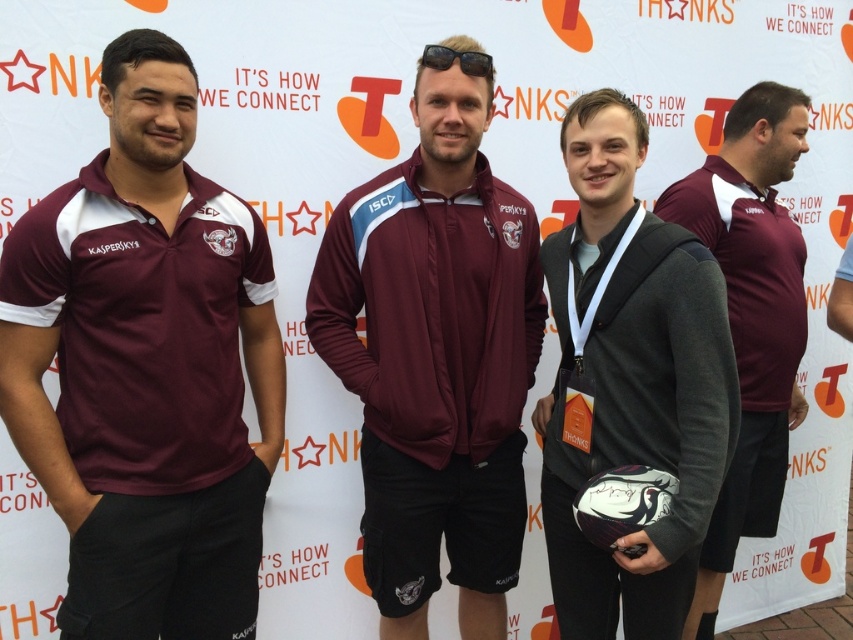
You are a photographer at the event and need to adjust the lighting to ensure both the maroon fabric jacket at center and the black plastic sunglasses at center are clearly visible. Considering their sizes, which object might require more focused lighting to avoid being overshadowed?

The black plastic sunglasses at center are smaller in size compared to the maroon fabric jacket at center, so they might require more focused lighting to ensure they are clearly visible and not overshadowed.

You are a photographer setting up for a group photo. You have to ensure that the maroon fabric jacket at center and the black plastic sunglasses at center are both visible in the frame. Given their sizes, which object might require more careful positioning to avoid being obscured?

The black plastic sunglasses at center might require more careful positioning because they are smaller in size compared to the maroon fabric jacket at center, making them easier to be obscured if not placed thoughtfully.